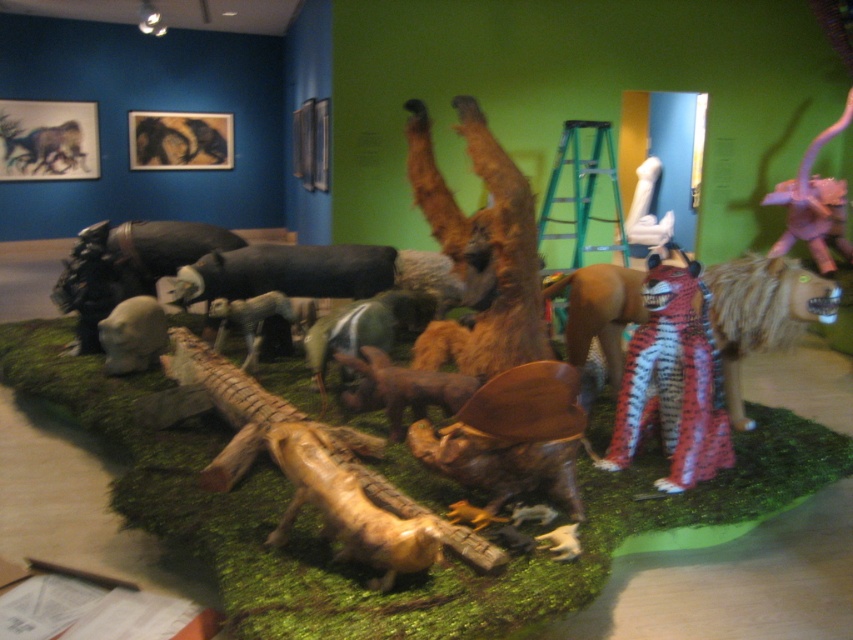
Is the position of purple matte dinosaur at upper right more distant than that of green felt dinosaur at center?

Yes, purple matte dinosaur at upper right is behind green felt dinosaur at center.

Which is more to the right, purple matte dinosaur at upper right or green felt dinosaur at center?

purple matte dinosaur at upper right

Where is `purple matte dinosaur at upper right`? purple matte dinosaur at upper right is located at coordinates (814, 204).

I want to click on purple matte dinosaur at upper right, so coord(814,204).

Between textured red and black fabric at center-right and green felt dinosaur at center, which one is positioned higher?

green felt dinosaur at center is higher up.

Where is `textured red and black fabric at center-right`? textured red and black fabric at center-right is located at coordinates (762, 314).

Does point (251, 490) come behind point (231, 300)?

No, it is in front of (231, 300).

Which of these two, green moss at center or smooth gray elephant at center, stands taller?

With more height is green moss at center.

Which is in front, point (582, 561) or point (291, 244)?

Point (582, 561) is in front.

Find the location of a particular element. This screenshot has width=853, height=640. green moss at center is located at coordinates (366, 570).